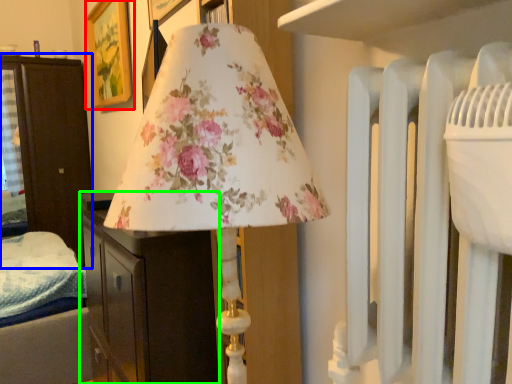
Question: Considering the real-world distances, which object is farthest from picture frame (highlighted by a red box)? furniture (highlighted by a blue box) or furniture (highlighted by a green box)?

Choices:
 (A) furniture
 (B) furniture

Answer: (B)